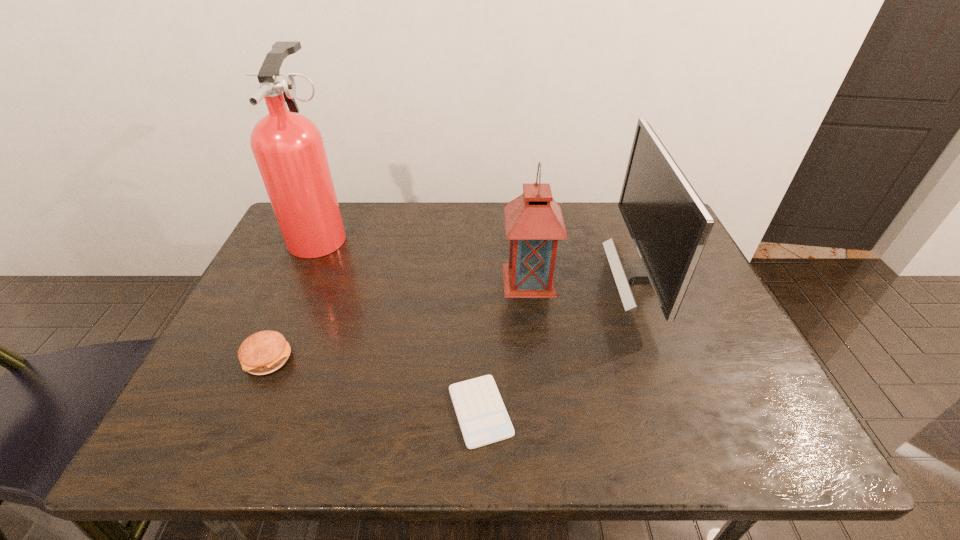
Where is `vacant space located on the left of the hamburger`? This screenshot has width=960, height=540. vacant space located on the left of the hamburger is located at coordinates (210, 359).

This screenshot has width=960, height=540. What are the coordinates of `vacant space located on the left of the calculator` in the screenshot? It's located at (365, 411).

I want to click on fire extinguisher at the far edge, so click(288, 147).

Image resolution: width=960 pixels, height=540 pixels. I want to click on monitor located in the far edge section of the desktop, so click(669, 224).

At what (x,y) coordinates should I click in order to perform the action: click on object present at the near edge. Please return your answer as a coordinate pair (x, y). Looking at the image, I should click on (483, 419).

Image resolution: width=960 pixels, height=540 pixels. In order to click on fire extinguisher present at the left edge in this screenshot , I will do `click(288, 147)`.

This screenshot has width=960, height=540. Identify the location of hamburger at the left edge. (264, 352).

You are a GUI agent. You are given a task and a screenshot of the screen. Output one action in this format:
    pyautogui.click(x=<x>, y=<y>)
    Task: Click on the object that is at the right edge
    
    Given the screenshot: What is the action you would take?
    pyautogui.click(x=669, y=224)

I want to click on object situated at the far left corner, so click(x=288, y=147).

The height and width of the screenshot is (540, 960). Find the location of `object that is at the far right corner`. object that is at the far right corner is located at coordinates (669, 224).